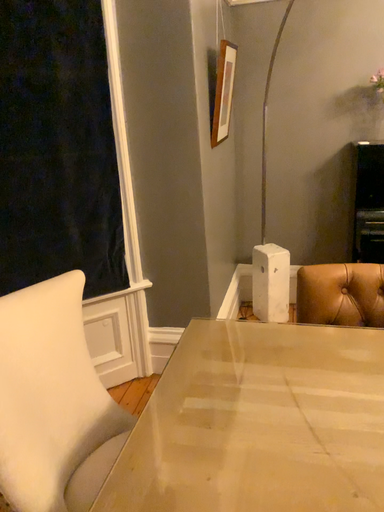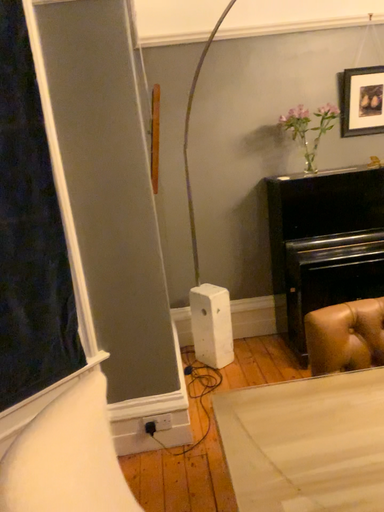
Question: How did the camera likely rotate when shooting the video?

Choices:
 (A) rotated right
 (B) rotated left

Answer: (A)